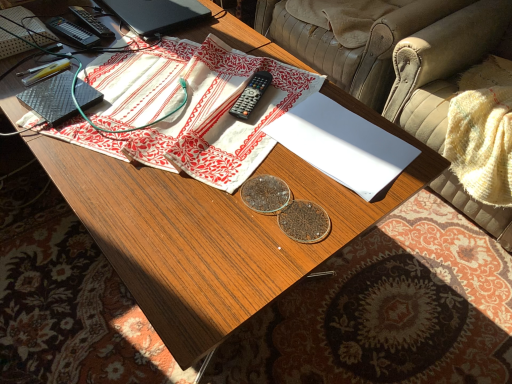
Find the location of a particular element. black plastic remote at center is located at coordinates click(251, 95).

Where is `white cotton cloth at center`? This screenshot has height=384, width=512. white cotton cloth at center is located at coordinates (188, 109).

The height and width of the screenshot is (384, 512). What do you see at coordinates (157, 14) in the screenshot?
I see `black matte laptop at upper left` at bounding box center [157, 14].

The image size is (512, 384). I want to click on beige leather armchair at upper right, the 2th armchair in the back-to-front sequence, so click(x=443, y=66).

Locate an element on the screen. This screenshot has width=512, height=384. white paper at center is located at coordinates (342, 145).

Can you tell me how much black matte laptop at upper left and leather armchair at upper right, the second armchair from the front, differ in facing direction?

They differ by 0.606 degrees in their facing directions.

I want to click on the 2nd armchair positioned below the black matte laptop at upper left (from a real-world perspective), so click(x=353, y=48).

Can you confirm if black matte laptop at upper left is bigger than leather armchair at upper right, placed as the 1th armchair when sorted from back to front?

Incorrect, black matte laptop at upper left is not larger than leather armchair at upper right, placed as the 1th armchair when sorted from back to front.

Between black matte laptop at upper left and leather armchair at upper right, placed as the 1th armchair when sorted from back to front, which one has less height?

black matte laptop at upper left is shorter.

Is point (260, 81) positioned behind point (237, 128)?

Yes, it is behind point (237, 128).

Are black plastic remote at center and white cotton cloth at center located far from each other?

black plastic remote at center is near white cotton cloth at center, not far away.

Can you confirm if black plastic remote at center is shorter than white cotton cloth at center?

Indeed, black plastic remote at center has a lesser height compared to white cotton cloth at center.

You are a GUI agent. You are given a task and a screenshot of the screen. Output one action in this format:
    pyautogui.click(x=<x>, y=<y>)
    Task: Click on the laptop located behind the white cotton cloth at center
    The width and height of the screenshot is (512, 384).
    Given the screenshot: What is the action you would take?
    pyautogui.click(x=157, y=14)

Considering the sizes of black matte laptop at upper left and white cotton cloth at center in the image, is black matte laptop at upper left bigger or smaller than white cotton cloth at center?

In the image, black matte laptop at upper left appears to be smaller than white cotton cloth at center.

Is black matte laptop at upper left next to white cotton cloth at center?

No, black matte laptop at upper left is not in contact with white cotton cloth at center.

Who is taller, black matte laptop at upper left or white cotton cloth at center?

Standing taller between the two is white cotton cloth at center.

Is point (480, 221) positioned in front of point (360, 176)?

No, (480, 221) is behind (360, 176).

Between beige leather armchair at upper right, the 2th armchair in the back-to-front sequence, and white paper at center, which one has less height?

white paper at center.

From a real-world perspective, does beige leather armchair at upper right, the 2th armchair in the back-to-front sequence, sit lower than white paper at center?

Yes.

Is leather armchair at upper right, the second armchair from the front, turned away from black matte laptop at upper left?

leather armchair at upper right, the second armchair from the front, is not turned away from black matte laptop at upper left.

Considering the positions of objects leather armchair at upper right, placed as the 1th armchair when sorted from back to front, and black matte laptop at upper left in the image provided, who is more to the right, leather armchair at upper right, placed as the 1th armchair when sorted from back to front, or black matte laptop at upper left?

From the viewer's perspective, leather armchair at upper right, placed as the 1th armchair when sorted from back to front, appears more on the right side.

Who is bigger, leather armchair at upper right, placed as the 1th armchair when sorted from back to front, or black matte laptop at upper left?

leather armchair at upper right, placed as the 1th armchair when sorted from back to front, is bigger.

Between leather armchair at upper right, the second armchair from the front, and black matte laptop at upper left, which one is positioned in front?

black matte laptop at upper left.

Looking at this image, does white cotton cloth at center touch black plastic remote at center?

No, white cotton cloth at center is not making contact with black plastic remote at center.

In the scene shown: Which of these two, white cotton cloth at center or black plastic remote at center, stands shorter?

black plastic remote at center is shorter.

Considering the relative sizes of white cotton cloth at center and black plastic remote at center in the image provided, is white cotton cloth at center wider than black plastic remote at center?

Indeed, white cotton cloth at center has a greater width compared to black plastic remote at center.

Does point (307, 86) lie behind point (254, 89)?

Yes, it is behind point (254, 89).

Is white paper at center at the left side of black plastic remote at center?

In fact, white paper at center is to the right of black plastic remote at center.

From a real-world perspective, is white paper at center physically above black plastic remote at center?

No, from a real-world perspective, white paper at center is not on top of black plastic remote at center.

Which of these two, white paper at center or black plastic remote at center, is thinner?

black plastic remote at center.

Where is `the 2nd armchair below the black matte laptop at upper left (from a real-world perspective)`? This screenshot has height=384, width=512. the 2nd armchair below the black matte laptop at upper left (from a real-world perspective) is located at coordinates (353, 48).

Identify the location of remote control on the right of white cotton cloth at center. This screenshot has height=384, width=512. (251, 95).

From the image, which object appears to be nearer to white cotton cloth at center, white paper at center or black plastic remote at center?

Based on the image, black plastic remote at center appears to be nearer to white cotton cloth at center.

Estimate the real-world distances between objects in this image. Which object is further from beige leather armchair at upper right, which is counted as the 1th armchair, starting from the front, leather armchair at upper right, the second armchair from the front, or white cotton cloth at center?

white cotton cloth at center is positioned further to the anchor beige leather armchair at upper right, which is counted as the 1th armchair, starting from the front.

Considering their positions, is white cotton cloth at center positioned further to black plastic remote at center than white paper at center?

white paper at center.

Estimate the real-world distances between objects in this image. Which object is further from black plastic remote at center, white paper at center or white cotton cloth at center?

The object further to black plastic remote at center is white paper at center.

Considering their positions, is white cotton cloth at center positioned closer to beige leather armchair at upper right, the 2th armchair in the back-to-front sequence, than white paper at center?

Based on the image, white paper at center appears to be nearer to beige leather armchair at upper right, the 2th armchair in the back-to-front sequence.

Considering their positions, is beige leather armchair at upper right, the 2th armchair in the back-to-front sequence, positioned further to black plastic remote at center than black matte laptop at upper left?

Among the two, beige leather armchair at upper right, the 2th armchair in the back-to-front sequence, is located further to black plastic remote at center.

Looking at the image, which one is located further to leather armchair at upper right, the second armchair from the front, black matte laptop at upper left or white paper at center?

white paper at center is positioned further to the anchor leather armchair at upper right, the second armchair from the front.

From the image, which object appears to be farther from black matte laptop at upper left, beige leather armchair at upper right, the 2th armchair in the back-to-front sequence, or black plastic remote at center?

beige leather armchair at upper right, the 2th armchair in the back-to-front sequence, lies further to black matte laptop at upper left than the other object.

At what (x,y) coordinates should I click in order to perform the action: click on notebook located between black matte laptop at upper left and leather armchair at upper right, placed as the 1th armchair when sorted from back to front, in the left-right direction. Please return your answer as a coordinate pair (x, y). This screenshot has width=512, height=384. Looking at the image, I should click on (342, 145).

Find the location of a particular element. cloth between black matte laptop at upper left and black plastic remote at center from top to bottom is located at coordinates (188, 109).

At what (x,y) coordinates should I click in order to perform the action: click on remote control that lies between leather armchair at upper right, placed as the 1th armchair when sorted from back to front, and white paper at center from top to bottom. Please return your answer as a coordinate pair (x, y). Looking at the image, I should click on [x=251, y=95].

The image size is (512, 384). I want to click on remote control between black matte laptop at upper left and beige leather armchair at upper right, the 2th armchair in the back-to-front sequence, in the horizontal direction, so click(251, 95).